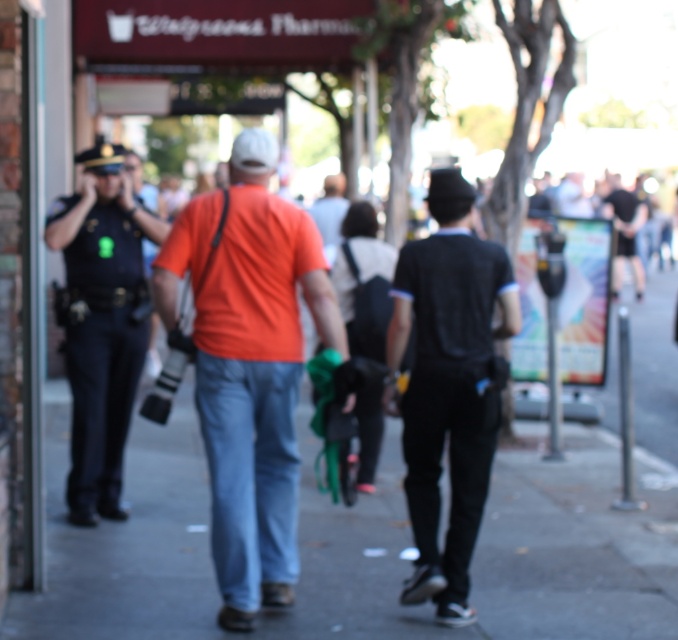
Which is in front, point (422, 243) or point (102, 483)?

Point (422, 243) is in front.

Can you confirm if black matte shirt at center is bigger than black uniform at left?

No.

In order to click on black matte shirt at center in this screenshot , I will do `click(450, 385)`.

Locate an element on the screen. black matte shirt at center is located at coordinates (450, 385).

Which is behind, point (142, 349) or point (614, 195)?

Positioned behind is point (614, 195).

Identify the location of black uniform at left. (102, 323).

How much distance is there between smooth concrete sidewalk at center and black matte shirt at center?

6.58 feet

Does smooth concrete sidewalk at center have a lesser width compared to black matte shirt at center?

Indeed, smooth concrete sidewalk at center has a lesser width compared to black matte shirt at center.

Who is more distant from viewer, (601, 547) or (407, 292)?

The point (601, 547) is more distant.

The height and width of the screenshot is (640, 678). I want to click on smooth concrete sidewalk at center, so click(x=494, y=548).